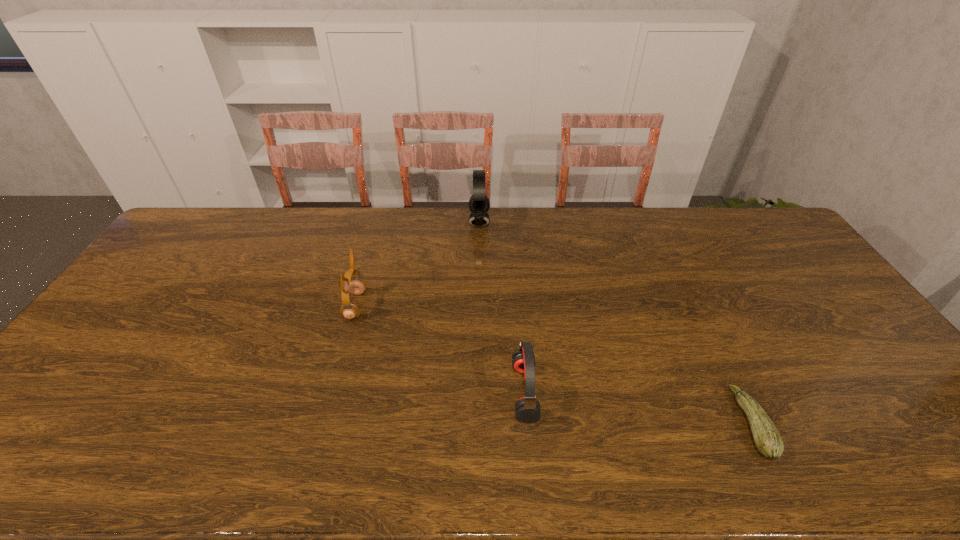
This screenshot has width=960, height=540. I want to click on vacant space located on the ear cups of the shortest earphone, so click(x=450, y=392).

The height and width of the screenshot is (540, 960). I want to click on vacant position located 0.110m on the ear cups of the shortest earphone, so click(469, 392).

This screenshot has height=540, width=960. I want to click on free spot located on the ear cups of the shortest earphone, so click(458, 392).

Where is `free spot located at the stem end of the rightmost object`? Image resolution: width=960 pixels, height=540 pixels. free spot located at the stem end of the rightmost object is located at coordinates (690, 423).

Locate an element on the screen. This screenshot has width=960, height=540. free point located at the stem end of the rightmost object is located at coordinates (673, 423).

The width and height of the screenshot is (960, 540). Identify the location of free spot located 0.190m at the stem end of the rightmost object. (660, 423).

In order to click on object located in the far edge section of the desktop in this screenshot , I will do `click(479, 204)`.

Image resolution: width=960 pixels, height=540 pixels. What are the coordinates of `object that is at the near edge` in the screenshot? It's located at (768, 441).

At what (x,y) coordinates should I click in order to perform the action: click on free space at the far edge of the desktop. Please return your answer as a coordinate pair (x, y). Looking at the image, I should click on (552, 221).

I want to click on vacant area at the near edge, so click(x=436, y=469).